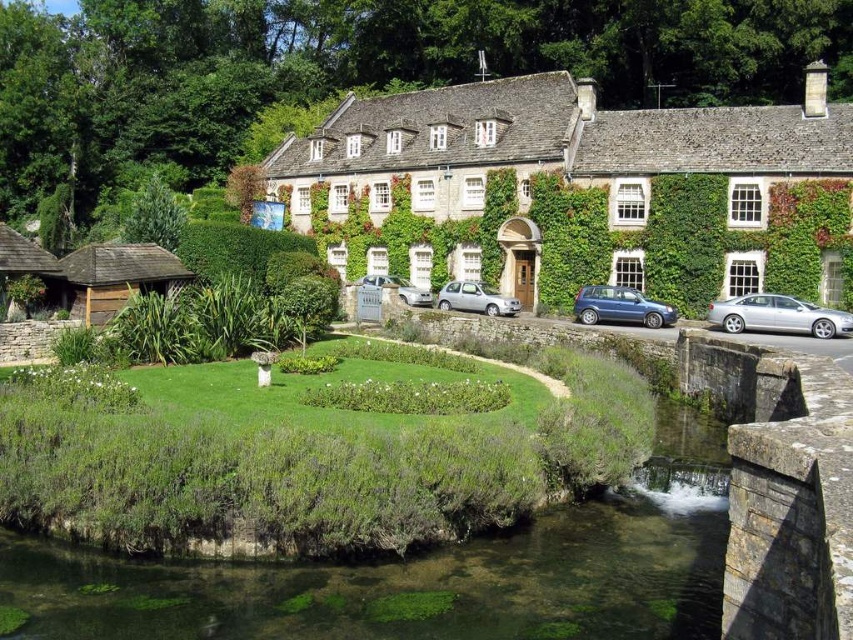
Question: Which point is closer to the camera taking this photo?

Choices:
 (A) 450,296
 (B) 381,276
 (C) 107,612

Answer: (C)

Question: Is silver metallic hatchback at center wider than silver metallic car at center?

Choices:
 (A) no
 (B) yes

Answer: (A)

Question: Does stone ivy-covered cottage at center appear on the right side of metallic blue hatchback at center?

Choices:
 (A) no
 (B) yes

Answer: (A)

Question: Can you confirm if stone ivy-covered cottage at center is positioned below silver metallic hatchback at center?

Choices:
 (A) no
 (B) yes

Answer: (A)

Question: Which of the following is the closest to the observer?

Choices:
 (A) silver metallic car at center
 (B) green mossy stone river at lower center
 (C) silver metallic sedan at right
 (D) metallic blue hatchback at center

Answer: (B)

Question: Among these points, which one is farthest from the camera?

Choices:
 (A) (436, 301)
 (B) (415, 301)

Answer: (A)